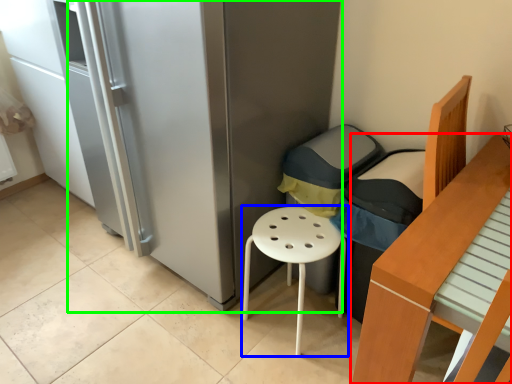
Question: Based on their relative distances, which object is farther from furniture (highlighted by a red box)? Choose from stool (highlighted by a blue box) and fridge (highlighted by a green box).

Choices:
 (A) stool
 (B) fridge

Answer: (B)